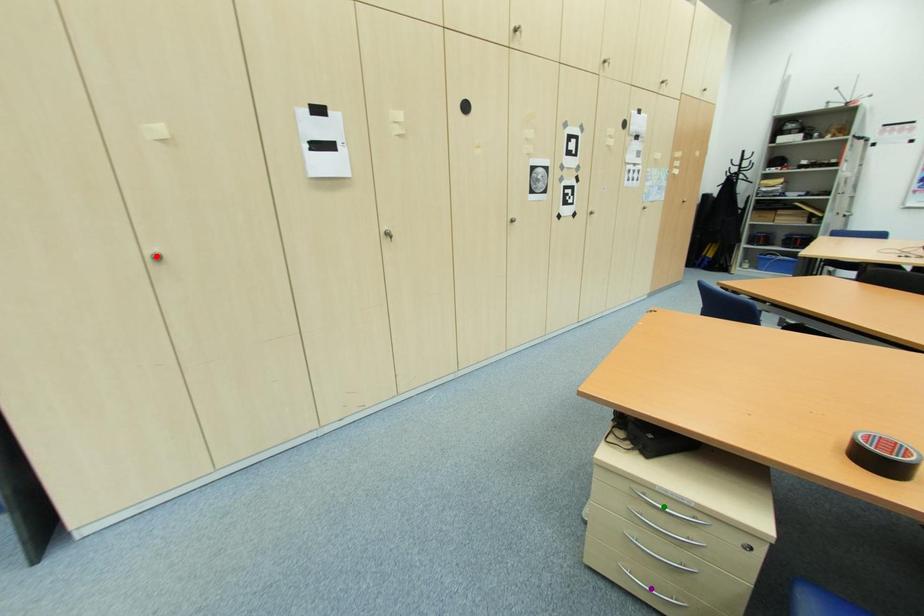
Order these from nearest to farthest:
A) green point
B) red point
C) purple point

green point < purple point < red point